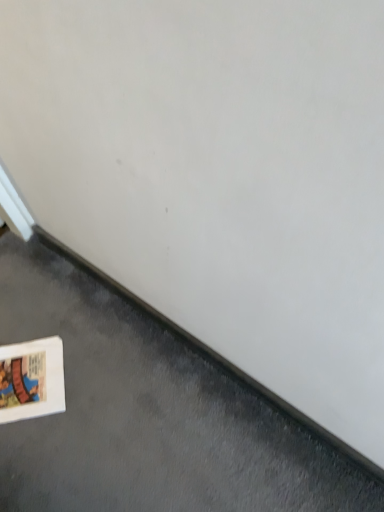
Question: Considering the relative positions of white cardboard at lower left and white matte book at lower left in the image provided, is white cardboard at lower left to the left or to the right of white matte book at lower left?

Choices:
 (A) left
 (B) right

Answer: (A)

Question: Is white cardboard at lower left in front of or behind white matte book at lower left in the image?

Choices:
 (A) behind
 (B) front

Answer: (A)

Question: From the image's perspective, is white cardboard at lower left above or below white matte book at lower left?

Choices:
 (A) below
 (B) above

Answer: (B)

Question: From a real-world perspective, is white matte book at lower left positioned above or below white cardboard at lower left?

Choices:
 (A) below
 (B) above

Answer: (B)

Question: Considering the relative positions of white matte book at lower left and white cardboard at lower left in the image provided, is white matte book at lower left to the left or to the right of white cardboard at lower left?

Choices:
 (A) right
 (B) left

Answer: (A)

Question: Is white matte book at lower left wider or thinner than white cardboard at lower left?

Choices:
 (A) wide
 (B) thin

Answer: (A)

Question: Is point pyautogui.click(x=307, y=486) closer or farther from the camera than point pyautogui.click(x=59, y=391)?

Choices:
 (A) farther
 (B) closer

Answer: (B)